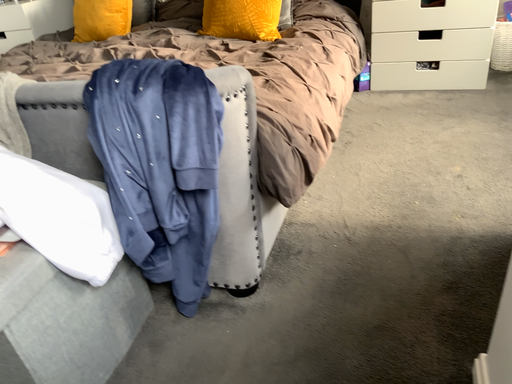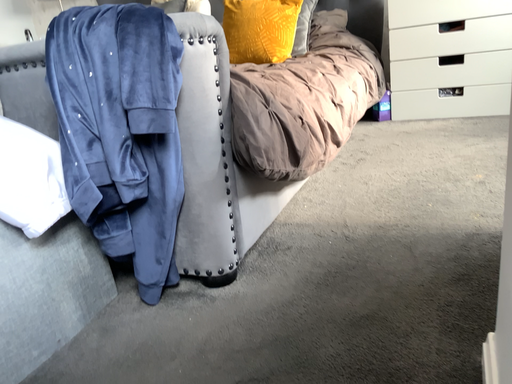
Question: How did the camera likely rotate when shooting the video?

Choices:
 (A) rotated upward
 (B) rotated downward

Answer: (A)